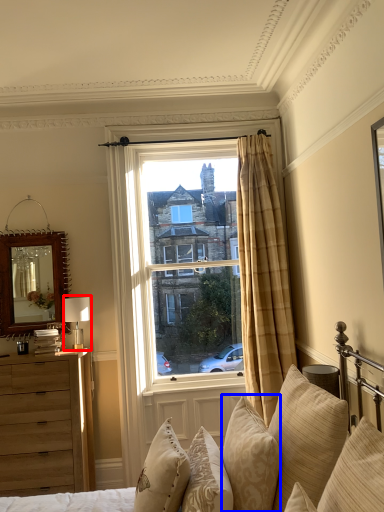
Question: Which object appears farthest to the camera in this image, table lamp (highlighted by a red box) or pillow (highlighted by a blue box)?

Choices:
 (A) table lamp
 (B) pillow

Answer: (A)